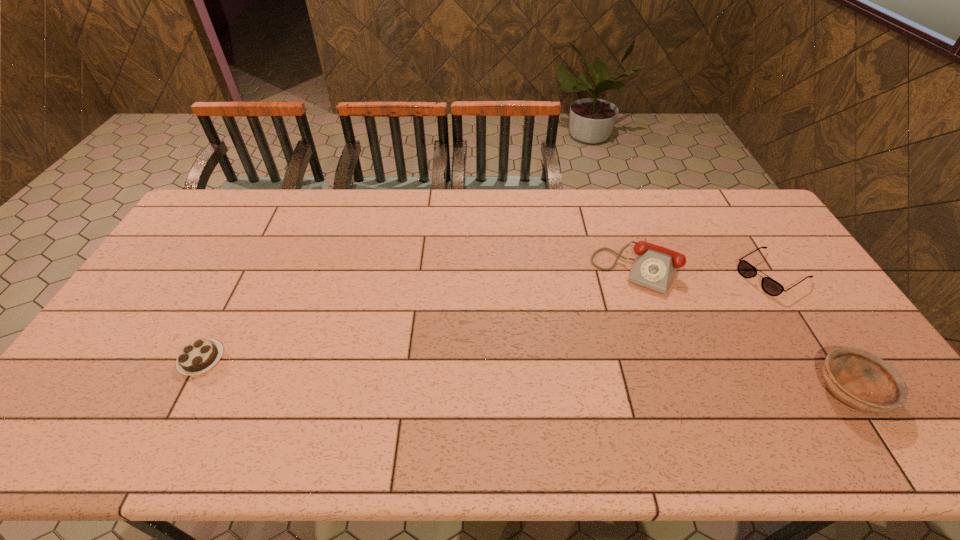
Find the location of `free space between the bowl and the third object from right to left`. free space between the bowl and the third object from right to left is located at coordinates (743, 329).

Locate an element on the screen. vacant space that is in between the spectacles and the bowl is located at coordinates (811, 332).

The width and height of the screenshot is (960, 540). In order to click on vacant area between the spectacles and the tallest object in this screenshot , I will do `click(704, 271)`.

Locate which object is the second closest to the chocolate cake. Please provide its 2D coordinates. Your answer should be formatted as a tuple, i.e. [(x, y)], where the tuple contains the x and y coordinates of a point satisfying the conditions above.

[(745, 269)]

This screenshot has height=540, width=960. I want to click on object that is the second nearest to the leftmost object, so click(745, 269).

This screenshot has width=960, height=540. I want to click on free region that satisfies the following two spatial constraints: 1. on the front side of the shortest object; 2. on the left side of the third shortest object, so click(x=185, y=390).